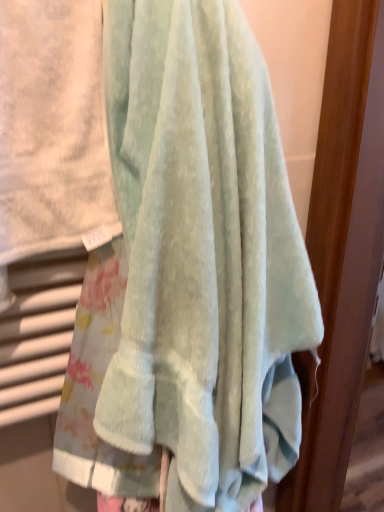
Question: Considering the relative positions of sage green towel at center, placed as the 1th towel when sorted from left to right, and light blue cotton towel at center, the 1th towel from the right, in the image provided, is sage green towel at center, placed as the 1th towel when sorted from left to right, to the left or to the right of light blue cotton towel at center, the 1th towel from the right,?

Choices:
 (A) right
 (B) left

Answer: (B)

Question: In the image, is sage green towel at center, which is the 2th towel in right-to-left order, positioned in front of or behind light blue cotton towel at center, the 2th towel when ordered from left to right?

Choices:
 (A) front
 (B) behind

Answer: (A)

Question: Looking at their shapes, would you say sage green towel at center, which is the 2th towel in right-to-left order, is wider or thinner than light blue cotton towel at center, the 1th towel from the right?

Choices:
 (A) wide
 (B) thin

Answer: (B)

Question: Visually, is light blue cotton towel at center, the 1th towel from the right, positioned to the left or to the right of sage green towel at center, placed as the 1th towel when sorted from left to right?

Choices:
 (A) left
 (B) right

Answer: (B)

Question: In terms of height, does light blue cotton towel at center, the 2th towel when ordered from left to right, look taller or shorter compared to sage green towel at center, placed as the 1th towel when sorted from left to right?

Choices:
 (A) short
 (B) tall

Answer: (B)

Question: From a real-world perspective, is light blue cotton towel at center, the 2th towel when ordered from left to right, physically located above or below sage green towel at center, which is the 2th towel in right-to-left order?

Choices:
 (A) below
 (B) above

Answer: (A)

Question: Is light blue cotton towel at center, the 2th towel when ordered from left to right, wider or thinner than sage green towel at center, placed as the 1th towel when sorted from left to right?

Choices:
 (A) thin
 (B) wide

Answer: (B)